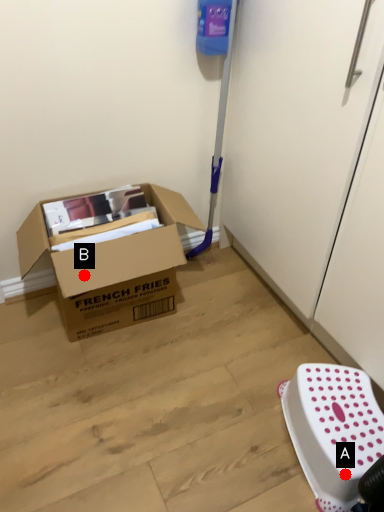
Question: Two points are circled on the image, labeled by A and B beside each circle. Which point is closer to the camera taking this photo?

Choices:
 (A) A is closer
 (B) B is closer

Answer: (A)